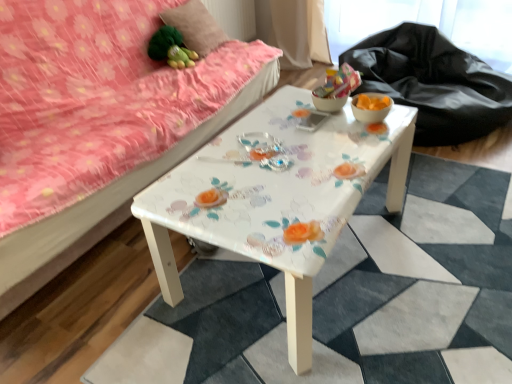
Locate an element on the screen. The height and width of the screenshot is (384, 512). vacant region in front of matte orange glass bowl at right, which is the 1th glass bowl from right to left is located at coordinates (367, 138).